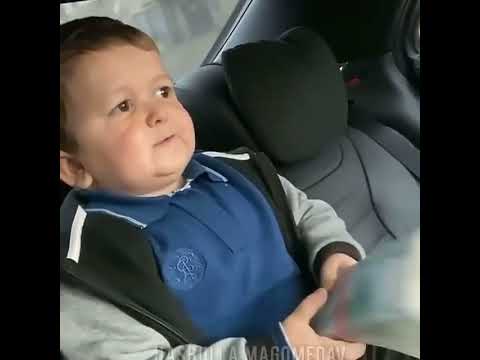
At what (x,y) coordinates should I click in order to perform the action: click on seat cushion. Please return your answer as a coordinate pair (x, y). The height and width of the screenshot is (360, 480). Looking at the image, I should click on (300, 89).